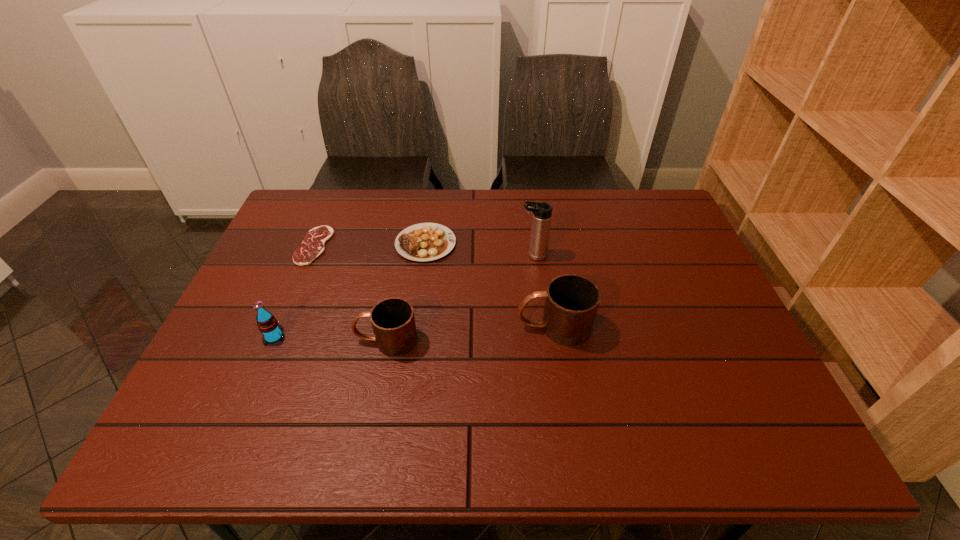
At what (x,y) coordinates should I click in order to perform the action: click on vacant space located 0.190m on the side of the fourth tallest object with the handle. Please return your answer as a coordinate pair (x, y). This screenshot has height=540, width=960. Looking at the image, I should click on (276, 340).

Identify the location of vacant space located 0.250m on the side of the fourth tallest object with the handle. (252, 340).

Where is `vacant area situated on the side of the taller mug with the handle`? The height and width of the screenshot is (540, 960). vacant area situated on the side of the taller mug with the handle is located at coordinates (399, 327).

The width and height of the screenshot is (960, 540). I want to click on free space located on the side of the taller mug with the handle, so [x=407, y=327].

Identify the location of free region located on the side of the taller mug with the handle. coord(488,327).

In order to click on vacant area situated 0.220m on the right of the shorter steak in this screenshot , I will do (403, 246).

Where is `free space located on the right of the right steak`? Image resolution: width=960 pixels, height=540 pixels. free space located on the right of the right steak is located at coordinates (509, 244).

At what (x,y) coordinates should I click in order to perform the action: click on free location located 0.300m on the handle side of the tallest object. Please return your answer as a coordinate pair (x, y). This screenshot has width=960, height=540. Looking at the image, I should click on (418, 255).

You are a GUI agent. You are given a task and a screenshot of the screen. Output one action in this format:
    pyautogui.click(x=<x>, y=<y>)
    Task: Click on the blank area located on the handle side of the tallest object
    The image size is (960, 540).
    Given the screenshot: What is the action you would take?
    pyautogui.click(x=407, y=255)

I want to click on vacant space located 0.310m on the handle side of the tallest object, so click(x=414, y=255).